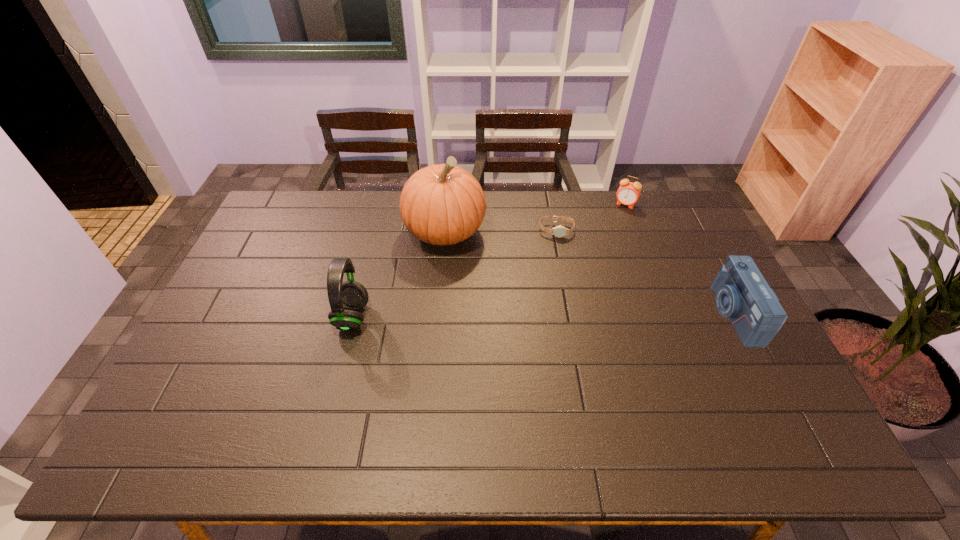
At what (x,y) coordinates should I click in order to perform the action: click on free space on the desktop that is between the second tallest object and the rightmost object and is positioned on the stem of the second object from left to right. Please return your answer as a coordinate pair (x, y). Looking at the image, I should click on (x=489, y=315).

Locate an element on the screen. Image resolution: width=960 pixels, height=540 pixels. free space on the desktop that is between the second tallest object and the camera and is positioned on the face of the shortest object is located at coordinates (563, 315).

At what (x,y) coordinates should I click in order to perform the action: click on vacant space on the desktop that is between the leftmost object and the camera and is positioned on the face of the fourth object from left to right. Please return your answer as a coordinate pair (x, y). Image resolution: width=960 pixels, height=540 pixels. Looking at the image, I should click on (568, 315).